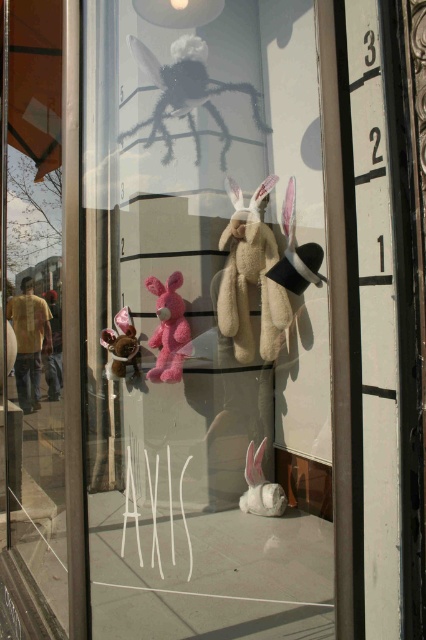
Is the position of white plush rabbit at center more distant than that of velvet plush bear at left?

No, white plush rabbit at center is closer to the viewer.

Between point (72, 221) and point (120, 321), which one is positioned behind?

Positioned behind is point (120, 321).

Where is `white plush rabbit at center`? white plush rabbit at center is located at coordinates (37, 307).

Which is more to the left, pink fluffy stuffed rabbit at center or velvet plush bear at left?

Positioned to the left is velvet plush bear at left.

Which is more to the right, pink fluffy stuffed rabbit at center or velvet plush bear at left?

pink fluffy stuffed rabbit at center is more to the right.

Identify the location of pink fluffy stuffed rabbit at center. (169, 330).

The width and height of the screenshot is (426, 640). Describe the element at coordinates (187, 93) in the screenshot. I see `fuzzy black spider at upper center` at that location.

Between point (204, 54) and point (109, 344), which one is positioned in front?

Point (204, 54)

What do you see at coordinates (187, 93) in the screenshot? I see `fuzzy black spider at upper center` at bounding box center [187, 93].

Image resolution: width=426 pixels, height=640 pixels. Find the location of `fuzzy black spider at upper center`. fuzzy black spider at upper center is located at coordinates (187, 93).